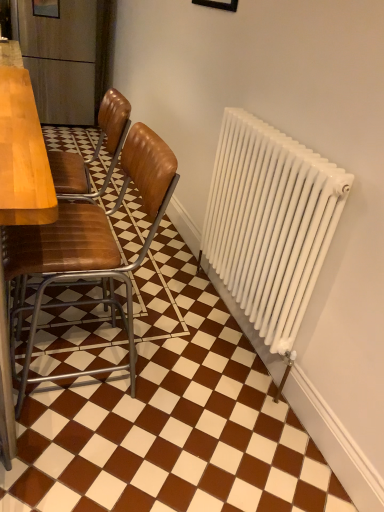
What are the coordinates of `vacant space behind brown leather chair at left` in the screenshot? It's located at (117, 308).